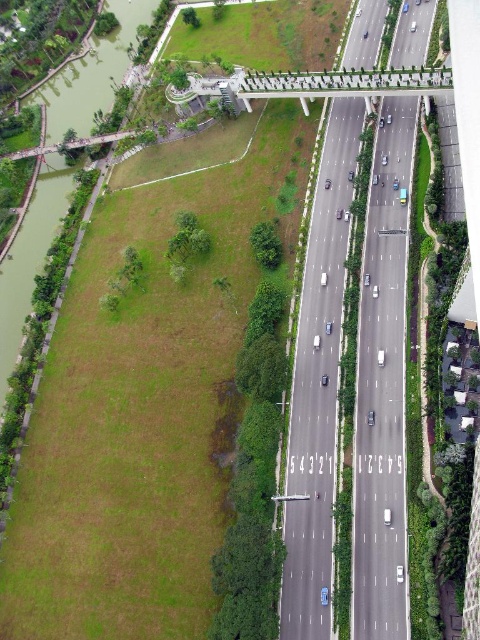
In the scene shown: You are a drone operator trying to capture aerial footage of the asphalt road at center and the green grass at lower left. Based on the scene, which object appears larger in the image?

The asphalt road at center appears larger in the image because it is taller than the green grass at lower left, making it occupy more space in the aerial view.

You are a drone operator trying to deliver a package to a specific location on the asphalt road at center. The delivery point is marked as point (x=317, y=384). Based on the scene, can you confirm whether this point is on the asphalt road at center?

The point (x=317, y=384) is marked as indicating the asphalt road at center, so yes, the delivery point is on the asphalt road at center.

What is the 2D coordinate of the asphalt road at center?

The 2D coordinate of the asphalt road at center is at point (317, 384).